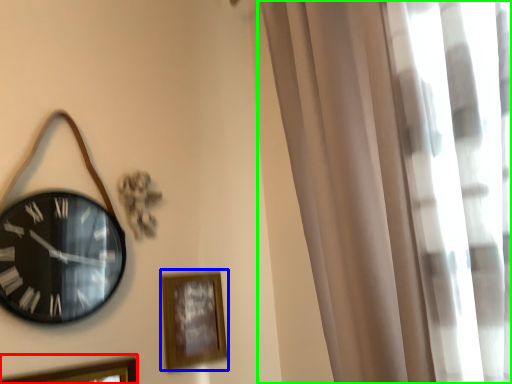
Question: Which object is the closest to the picture frame (highlighted by a red box)? Choose among these: picture frame (highlighted by a blue box) or curtain (highlighted by a green box).

Choices:
 (A) picture frame
 (B) curtain

Answer: (A)